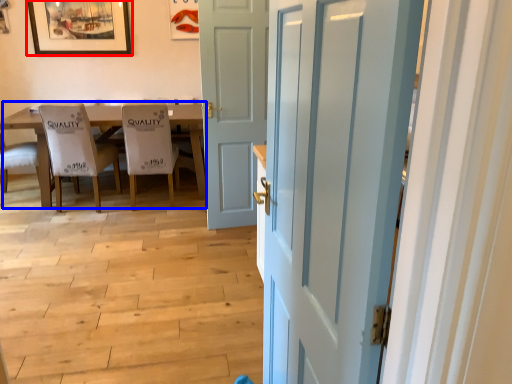
Question: Which of the following is the closest to the observer, picture frame (highlighted by a red box) or kitchen & dining room table (highlighted by a blue box)?

Choices:
 (A) picture frame
 (B) kitchen & dining room table

Answer: (B)